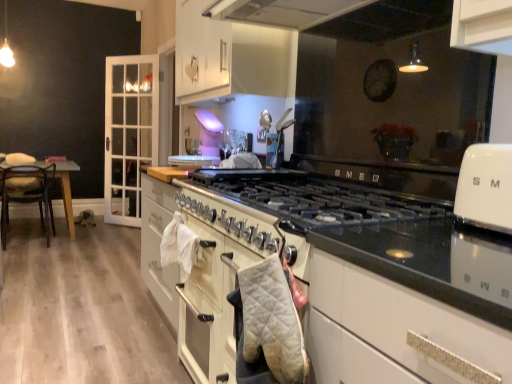
Question: Based on their sizes in the image, would you say white quilted oven mitt at center is bigger or smaller than white glossy oven at upper right?

Choices:
 (A) small
 (B) big

Answer: (A)

Question: Is white quilted oven mitt at center taller or shorter than white glossy oven at upper right?

Choices:
 (A) tall
 (B) short

Answer: (A)

Question: Estimate the real-world distances between objects in this image. Which object is farther from the wooden chair at left?

Choices:
 (A) white glossy oven at upper right
 (B) white quilted oven mitt at center
 (C) white quilted oven mitt at center
 (D) white glossy cabinet at upper center, the second cabinetry in the back-to-front sequence
 (E) white glossy cabinet at left, the 2th cabinetry from the right

Answer: (A)

Question: Which of these objects is positioned farthest from the white glossy oven at upper right?

Choices:
 (A) wooden chair at left
 (B) white quilted oven mitt at center
 (C) white quilted oven mitt at center
 (D) white glossy cabinet at left, which is counted as the 1th cabinetry, starting from the left
 (E) white glossy cabinet at upper center, which is counted as the first cabinetry, starting from the right

Answer: (D)